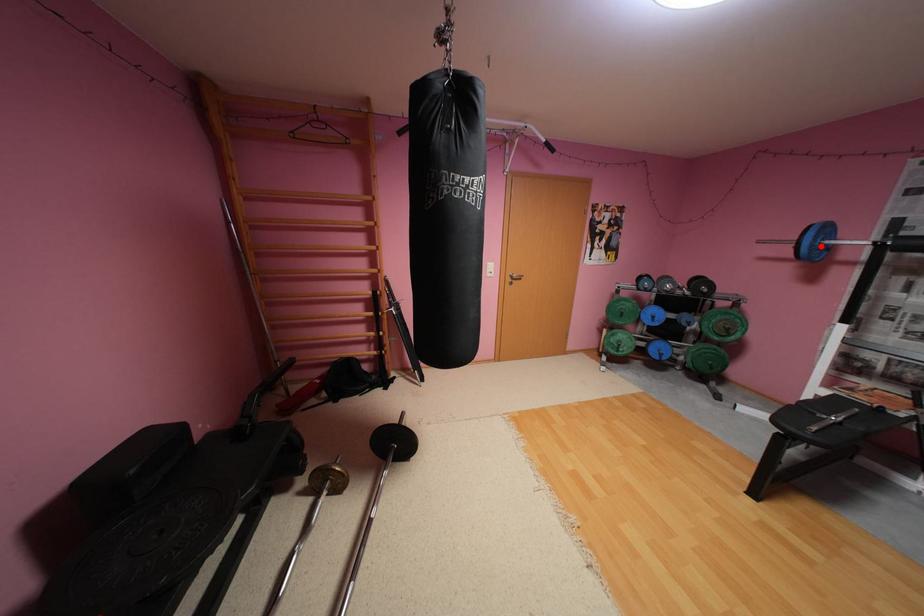
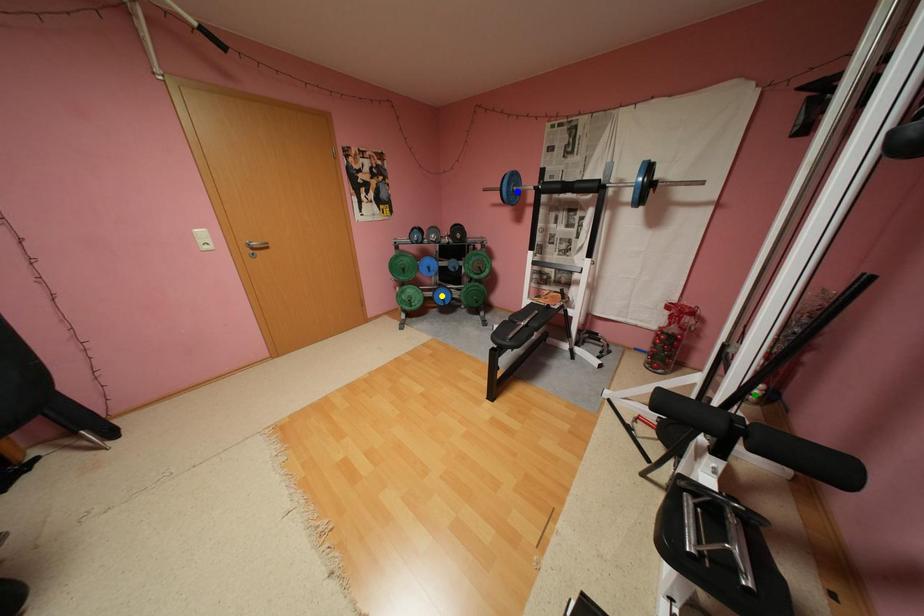
Question: I am providing you with two images of the same scene from different viewpoints. A red point is marked on the first image. You are given multiple points on the second image. Which point in image 2 represents the same 3d spot as the red point in image 1?

Choices:
 (A) yellow point
 (B) blue point
 (C) green point

Answer: (B)